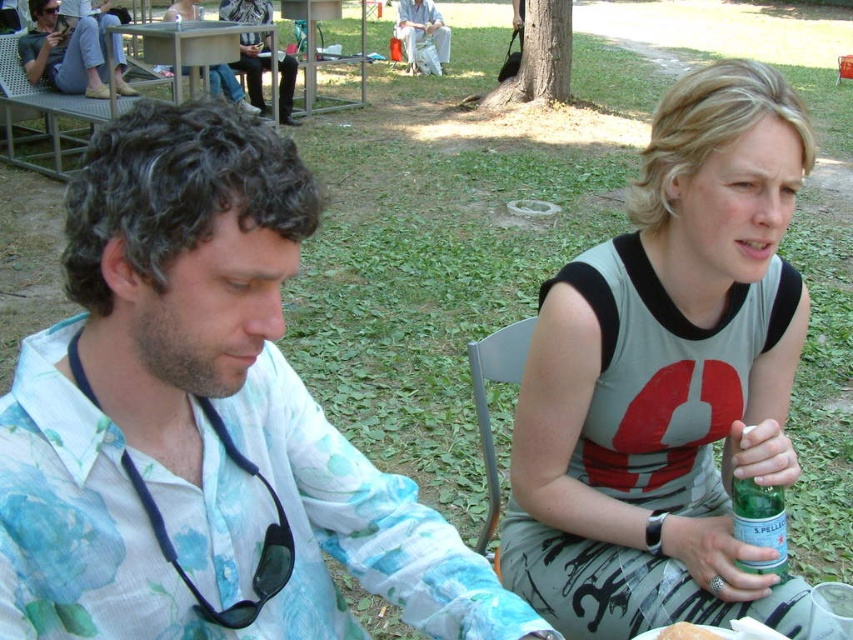
Can you confirm if black fabric stethoscope at left is taller than white fluffy bread at lower center?

Yes, black fabric stethoscope at left is taller than white fluffy bread at lower center.

What do you see at coordinates (260, 547) in the screenshot?
I see `black fabric stethoscope at left` at bounding box center [260, 547].

Locate an element on the screen. black fabric stethoscope at left is located at coordinates (260, 547).

Which is behind, point (62, 513) or point (730, 96)?

Point (730, 96)

The width and height of the screenshot is (853, 640). Describe the element at coordinates (202, 420) in the screenshot. I see `floral cotton shirt at left` at that location.

Which is behind, point (25, 340) or point (759, 129)?

The point (759, 129) is behind.

Image resolution: width=853 pixels, height=640 pixels. In order to click on floral cotton shirt at left in this screenshot , I will do `click(202, 420)`.

Does point (397, 35) lie in front of point (704, 636)?

No, (397, 35) is further to viewer.

In the scene shown: Does matte white pants at center appear on the right side of white fluffy bread at lower center?

No, matte white pants at center is not to the right of white fluffy bread at lower center.

Who is more distant from viewer, (x=408, y=32) or (x=672, y=632)?

Positioned behind is point (x=408, y=32).

Where is `matte white pants at center`? The width and height of the screenshot is (853, 640). matte white pants at center is located at coordinates (421, 32).